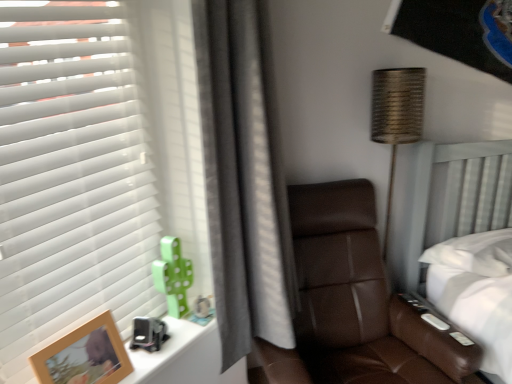
Question: Would you say green matte cactus at left is inside or outside white matte window blind at left?

Choices:
 (A) outside
 (B) inside

Answer: (B)

Question: In terms of size, does green matte cactus at left appear bigger or smaller than white matte window blind at left?

Choices:
 (A) big
 (B) small

Answer: (B)

Question: Estimate the real-world distances between objects in this image. Which object is closer to the white matte window blind at left?

Choices:
 (A) green matte cactus at left
 (B) brown leather chair at center
 (C) gray fabric curtain at center
 (D) wooden photo frame at lower left

Answer: (D)

Question: Which is farther from the green matte cactus at left?

Choices:
 (A) white matte window blind at left
 (B) wooden photo frame at lower left
 (C) brown leather chair at center
 (D) gray fabric curtain at center

Answer: (C)